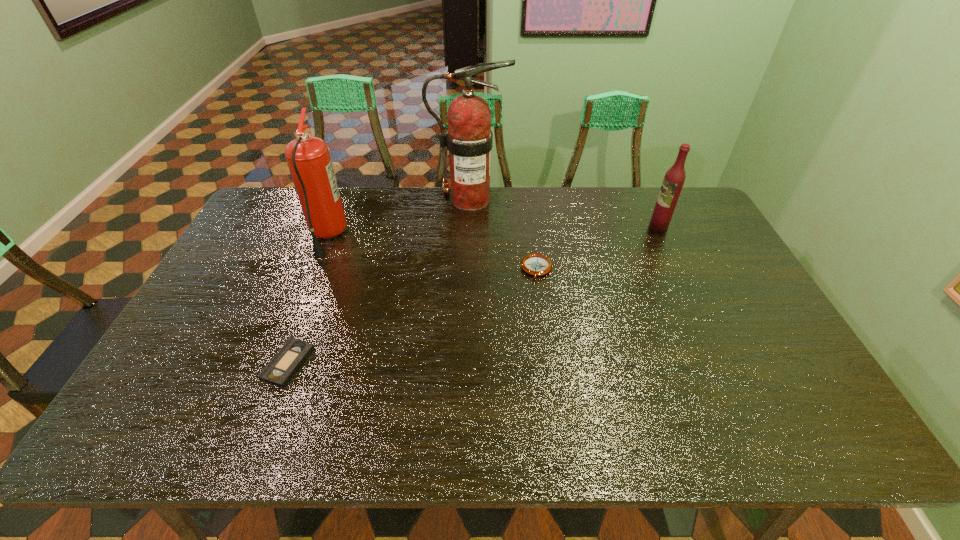
The height and width of the screenshot is (540, 960). Find the location of `vacant area located at the nozzle of the farther fire extinguisher`. vacant area located at the nozzle of the farther fire extinguisher is located at coordinates (588, 199).

This screenshot has width=960, height=540. I want to click on free space located 0.210m on the instruction side of the shorter fire extinguisher, so point(409,236).

Where is `free spot located 0.260m on the label of the liquor`? free spot located 0.260m on the label of the liquor is located at coordinates (572, 227).

Locate an element on the screen. The width and height of the screenshot is (960, 540). free space located on the label of the liquor is located at coordinates (555, 227).

You are a GUI agent. You are given a task and a screenshot of the screen. Output one action in this format:
    pyautogui.click(x=<x>, y=<y>)
    Task: Click on the free space located 0.110m on the label of the liquor
    This screenshot has width=960, height=540.
    Given the screenshot: What is the action you would take?
    pyautogui.click(x=616, y=227)

Image resolution: width=960 pixels, height=540 pixels. What are the coordinates of `free location located on the back of the fourth object from left to right` in the screenshot? It's located at (533, 240).

Where is `vacant space located on the back of the videotape`? Image resolution: width=960 pixels, height=540 pixels. vacant space located on the back of the videotape is located at coordinates (318, 284).

I want to click on liquor located in the far edge section of the desktop, so click(x=674, y=179).

Where is `object present at the right edge`? object present at the right edge is located at coordinates (674, 179).

Where is `object that is at the far right corner`? This screenshot has width=960, height=540. object that is at the far right corner is located at coordinates (674, 179).